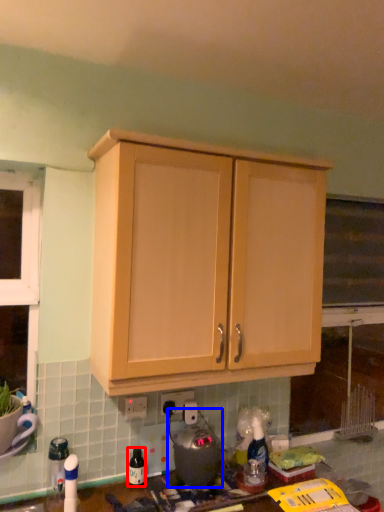
Question: Which of the following is the farthest to the observer, bottle (highlighted by a red box) or appliance (highlighted by a blue box)?

Choices:
 (A) bottle
 (B) appliance

Answer: (A)